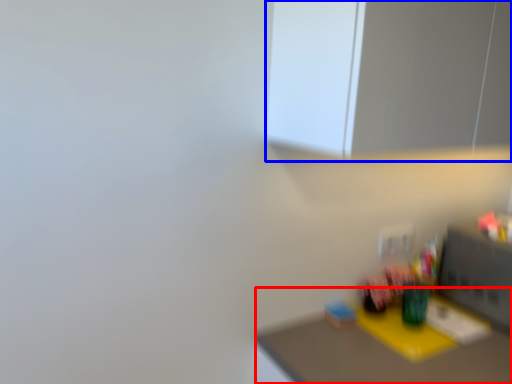
Question: Among these objects, which one is nearest to the camera, table (highlighted by a red box) or medicine cabinet (highlighted by a blue box)?

Choices:
 (A) table
 (B) medicine cabinet

Answer: (B)